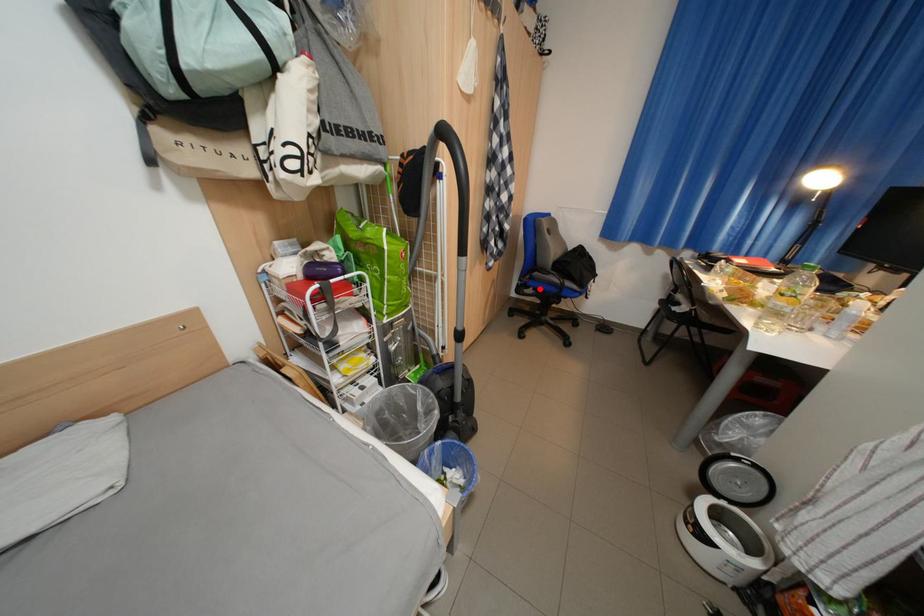
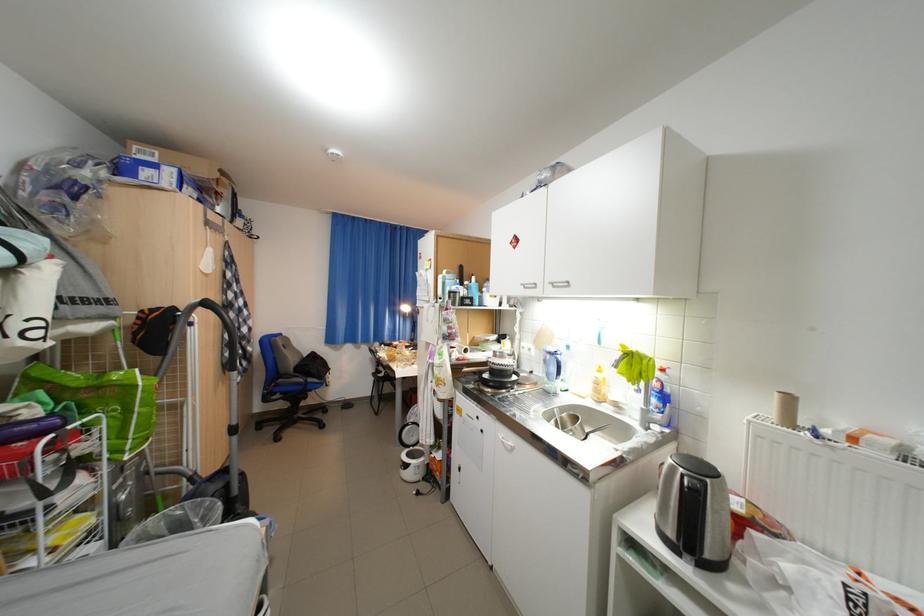
Question: I am providing you with two images of the same scene from different viewpoints. A red point is shown in image1. For the corresponding object point in image2, is it positioned nearer or farther from the camera?

Choices:
 (A) Nearer
 (B) Farther

Answer: (B)